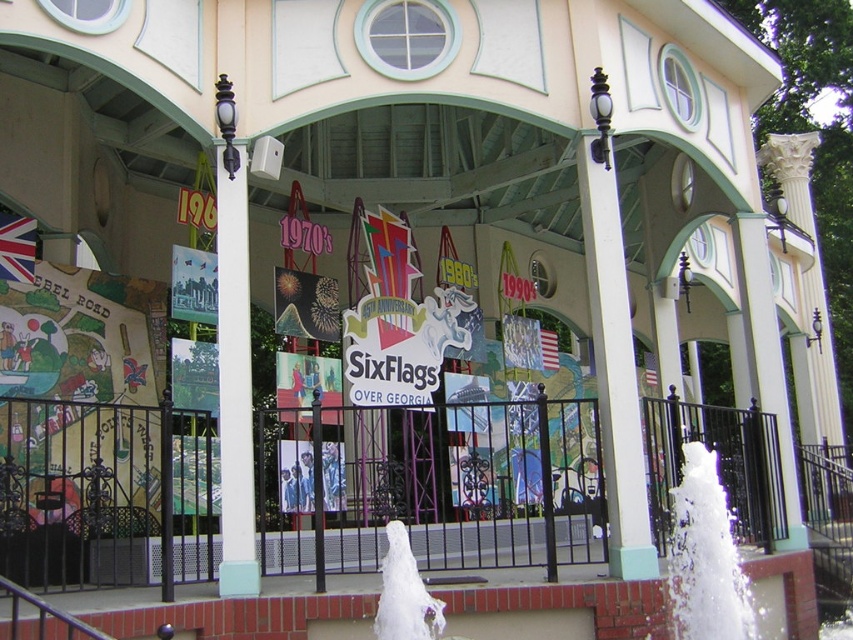
Question: Considering the relative positions of white matte fountain at center and white frothy water at lower right in the image provided, where is white matte fountain at center located with respect to white frothy water at lower right?

Choices:
 (A) below
 (B) above

Answer: (A)

Question: Which point appears closest to the camera in this image?

Choices:
 (A) (430, 529)
 (B) (683, 621)
 (C) (376, 628)

Answer: (C)

Question: Is white matte fountain at center positioned behind white frothy water at lower center?

Choices:
 (A) yes
 (B) no

Answer: (A)

Question: Among these objects, which one is farthest from the camera?

Choices:
 (A) white frothy water at lower right
 (B) white frothy water at lower center
 (C) white matte fountain at center

Answer: (A)

Question: Considering the real-world distances, which object is farthest from the white frothy water at lower center?

Choices:
 (A) white matte fountain at center
 (B) white frothy water at lower right

Answer: (A)

Question: Is white matte fountain at center behind white frothy water at lower right?

Choices:
 (A) no
 (B) yes

Answer: (A)